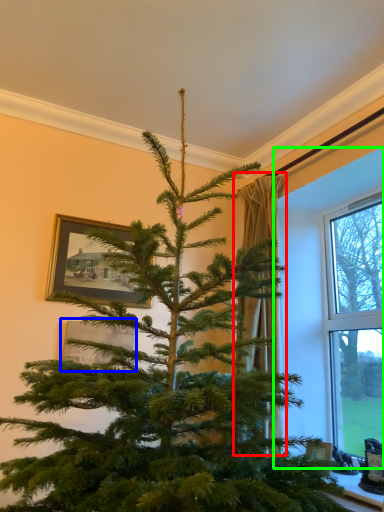
Question: Which object is positioned closest to curtain (highlighted by a red box)? Select from picture frame (highlighted by a blue box) and window frame (highlighted by a green box).

Choices:
 (A) picture frame
 (B) window frame

Answer: (B)